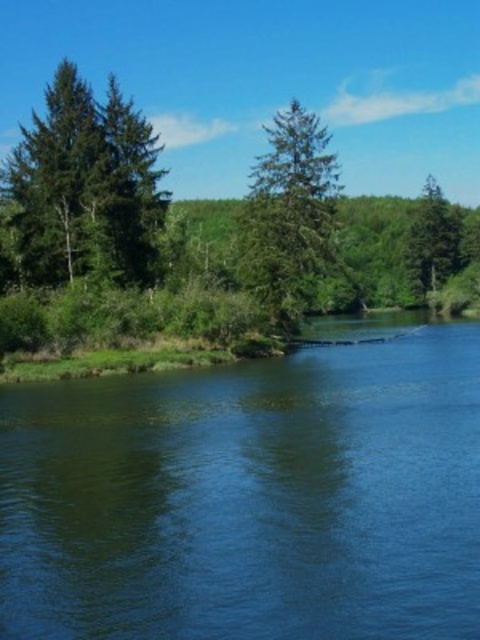
Which of these two, green matte tree at left or green matte tree at upper right, stands shorter?

green matte tree at left

How far apart are green matte tree at left and green matte tree at upper right?

The distance of green matte tree at left from green matte tree at upper right is 89.88 meters.

Measure the distance between point (79,200) and camera.

Point (79,200) and camera are 60.53 meters apart.

Where is `green matte tree at left`? The width and height of the screenshot is (480, 640). green matte tree at left is located at coordinates (84, 188).

Can you confirm if green grassy river at lower left is thinner than green matte tree at upper right?

No, green grassy river at lower left is not thinner than green matte tree at upper right.

Can you confirm if green grassy river at lower left is positioned below green matte tree at upper right?

Yes.

Between point (31, 589) and point (453, 212), which one is positioned behind?

Point (453, 212)

You are a GUI agent. You are given a task and a screenshot of the screen. Output one action in this format:
    pyautogui.click(x=<x>, y=<y>)
    Task: Click on the green grassy river at lower left
    The height and width of the screenshot is (640, 480).
    Given the screenshot: What is the action you would take?
    pyautogui.click(x=251, y=497)

Is green matte tree at center in front of green matte tree at upper right?

Yes, green matte tree at center is in front of green matte tree at upper right.

Between green matte tree at center and green matte tree at upper right, which one is positioned lower?

green matte tree at center is below.

Is point (248, 220) behind point (437, 241)?

That is False.

I want to click on green matte tree at center, so click(x=289, y=216).